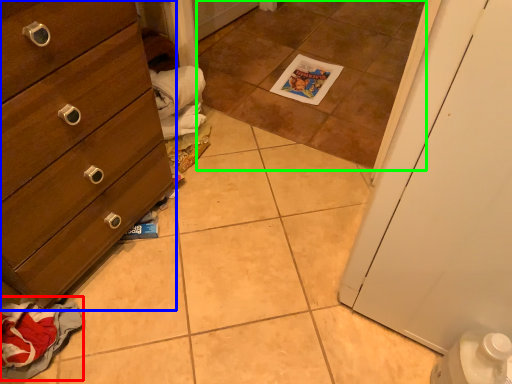
Question: Considering the real-world distances, which object is closest to material (highlighted by a red box)? chest of drawers (highlighted by a blue box) or tile (highlighted by a green box).

Choices:
 (A) chest of drawers
 (B) tile

Answer: (A)